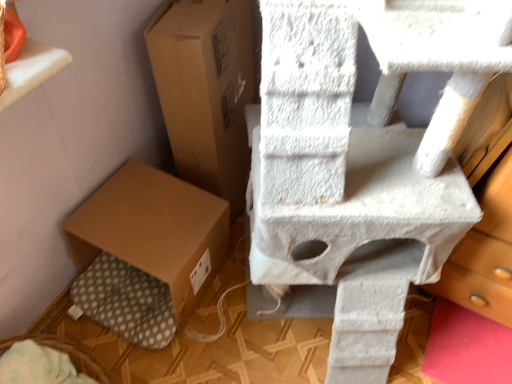
Question: Would you say brown cardboard box at center, the 1th cardboard box when ordered from top to bottom, is inside or outside brown cardboard box at lower left, arranged as the first cardboard box when ordered from the bottom?

Choices:
 (A) inside
 (B) outside

Answer: (B)

Question: From the image's perspective, is brown cardboard box at center, the 1th cardboard box when ordered from top to bottom, located above or below brown cardboard box at lower left, arranged as the first cardboard box when ordered from the bottom?

Choices:
 (A) above
 (B) below

Answer: (A)

Question: Based on their relative distances, which object is farther from the white textured cat tree at upper right?

Choices:
 (A) brown cardboard box at center, marked as the 2th cardboard box in a bottom-to-top arrangement
 (B) brown cardboard box at lower left, arranged as the first cardboard box when ordered from the bottom

Answer: (B)

Question: Based on their relative distances, which object is farther from the white textured cat tree at upper right?

Choices:
 (A) brown cardboard box at lower left, arranged as the first cardboard box when ordered from the bottom
 (B) brown cardboard box at center, the 1th cardboard box when ordered from top to bottom

Answer: (A)